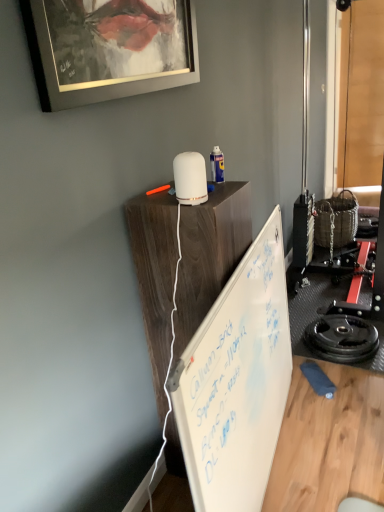
At what (x,y) coordinates should I click in order to perform the action: click on vacant point to the right of white matte wood table at upper center. Please return your answer as a coordinate pair (x, y). The height and width of the screenshot is (512, 384). Looking at the image, I should click on (295, 461).